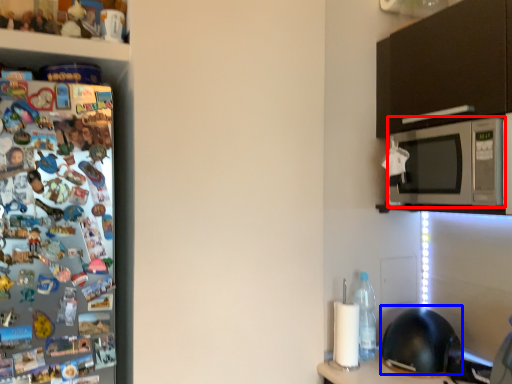
Question: Which of the following is the closest to the observer, microwave oven (highlighted by a red box) or helmet (highlighted by a blue box)?

Choices:
 (A) microwave oven
 (B) helmet

Answer: (A)